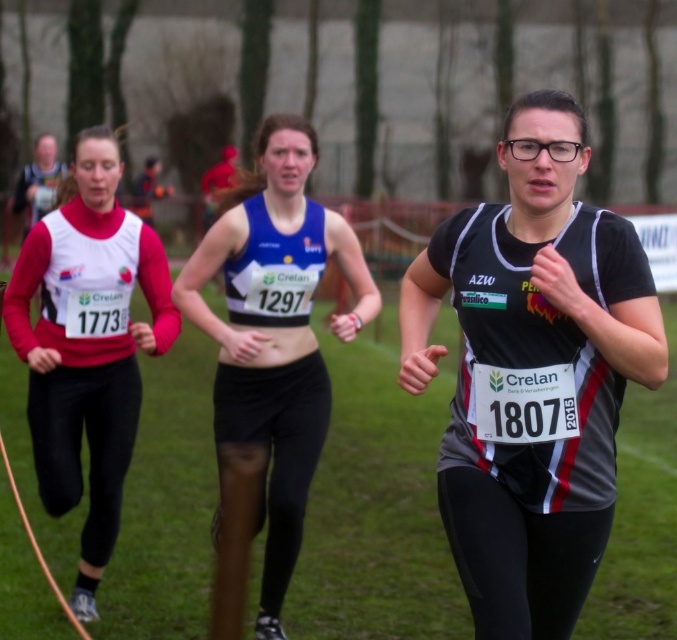
You are a spectator at the cross country race. You see the black matte running suit at center and the matte white vest at left. Which runner is higher in the image?

The black matte running suit at center is higher in the image than the matte white vest at left.

You are a photographer trying to capture a photo of the black matte running suit at center and the matte black bib at left. Since both are black, you want to ensure they are distinguishable in your photo. Which object should you focus on to ensure the bib is visible above the running suit?

The black matte running suit at center is positioned under the matte black bib at left, so focusing on the matte black bib at left will ensure it remains visible above the running suit.